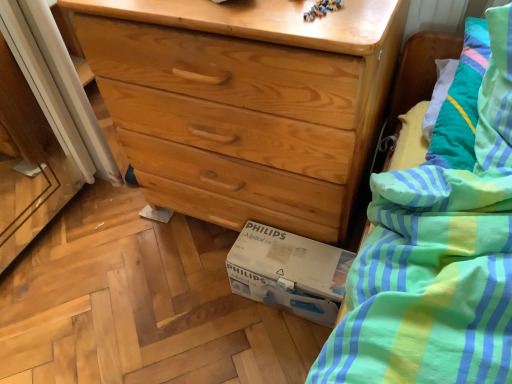
Identify the location of free space in front of white cardboard box at lower center. (273, 348).